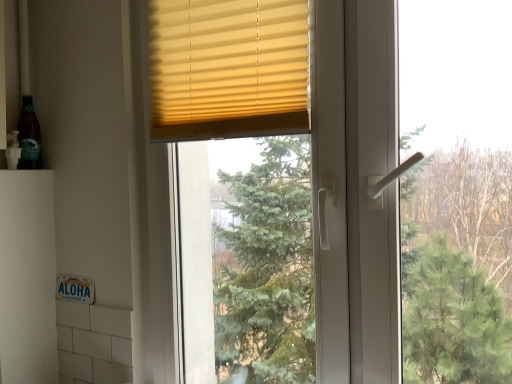
Identify the location of yellow matte blinds at upper center. This screenshot has width=512, height=384. (228, 68).

The width and height of the screenshot is (512, 384). What do you see at coordinates (228, 68) in the screenshot?
I see `yellow matte blinds at upper center` at bounding box center [228, 68].

At what (x,y) coordinates should I click in order to perform the action: click on translucent glass bottle at left. Please return your answer as a coordinate pair (x, y). The width and height of the screenshot is (512, 384). Looking at the image, I should click on (29, 136).

The image size is (512, 384). Describe the element at coordinates (29, 136) in the screenshot. I see `translucent glass bottle at left` at that location.

Locate an element on the screen. The height and width of the screenshot is (384, 512). yellow matte blinds at upper center is located at coordinates (228, 68).

Does translucent glass bottle at left appear on the right side of yellow matte blinds at upper center?

No, translucent glass bottle at left is not to the right of yellow matte blinds at upper center.

Is translucent glass bottle at left behind yellow matte blinds at upper center?

Yes, translucent glass bottle at left is further from the camera.

Is point (35, 141) positioned after point (183, 70)?

Yes, point (35, 141) is farther from viewer.

From the image's perspective, would you say translucent glass bottle at left is positioned over yellow matte blinds at upper center?

Incorrect, from the image's perspective, translucent glass bottle at left is lower than yellow matte blinds at upper center.

Consider the image. From a real-world perspective, which is physically above, translucent glass bottle at left or yellow matte blinds at upper center?

yellow matte blinds at upper center, from a real-world perspective.

Which object is wider, translucent glass bottle at left or yellow matte blinds at upper center?

translucent glass bottle at left.

Does translucent glass bottle at left have a greater height compared to yellow matte blinds at upper center?

No, translucent glass bottle at left is not taller than yellow matte blinds at upper center.

Considering the sizes of objects translucent glass bottle at left and yellow matte blinds at upper center in the image provided, who is bigger, translucent glass bottle at left or yellow matte blinds at upper center?

With larger size is yellow matte blinds at upper center.

Is translucent glass bottle at left not inside yellow matte blinds at upper center?

Yes, translucent glass bottle at left is outside of yellow matte blinds at upper center.

Are translucent glass bottle at left and yellow matte blinds at upper center far apart?

translucent glass bottle at left is actually quite close to yellow matte blinds at upper center.

Could you tell me if translucent glass bottle at left is facing yellow matte blinds at upper center?

Yes, translucent glass bottle at left is turned towards yellow matte blinds at upper center.

Looking at this image, how many degrees apart are the facing directions of translucent glass bottle at left and yellow matte blinds at upper center?

There is a 90-degree angle between the facing directions of translucent glass bottle at left and yellow matte blinds at upper center.

At what (x,y) coordinates should I click in order to perform the action: click on bottle that appears below the yellow matte blinds at upper center (from a real-world perspective). Please return your answer as a coordinate pair (x, y). The width and height of the screenshot is (512, 384). Looking at the image, I should click on (29, 136).

Is yellow matte blinds at upper center at the right side of translucent glass bottle at left?

Yes, yellow matte blinds at upper center is to the right of translucent glass bottle at left.

In the scene shown: Relative to translucent glass bottle at left, is yellow matte blinds at upper center in front or behind?

yellow matte blinds at upper center is in front of translucent glass bottle at left.

Does point (259, 48) lie behind point (29, 162)?

That is False.

From the image's perspective, is yellow matte blinds at upper center located beneath translucent glass bottle at left?

Incorrect, from the image's perspective, yellow matte blinds at upper center is higher than translucent glass bottle at left.

From a real-world perspective, is yellow matte blinds at upper center positioned above or below translucent glass bottle at left?

yellow matte blinds at upper center is situated higher than translucent glass bottle at left in the real world.

Looking at their sizes, would you say yellow matte blinds at upper center is wider or thinner than translucent glass bottle at left?

yellow matte blinds at upper center is thinner than translucent glass bottle at left.

Between yellow matte blinds at upper center and translucent glass bottle at left, which one has more height?

yellow matte blinds at upper center is taller.

Is yellow matte blinds at upper center smaller than translucent glass bottle at left?

No.

Would you say yellow matte blinds at upper center is outside translucent glass bottle at left?

yellow matte blinds at upper center is positioned outside translucent glass bottle at left.

Is yellow matte blinds at upper center far away from translucent glass bottle at left?

Actually, yellow matte blinds at upper center and translucent glass bottle at left are a little close together.

Could you tell me if yellow matte blinds at upper center is turned towards translucent glass bottle at left?

Result: No, yellow matte blinds at upper center is not facing towards translucent glass bottle at left.

Locate an element on the screen. The image size is (512, 384). bottle below the yellow matte blinds at upper center (from a real-world perspective) is located at coordinates 29,136.

The height and width of the screenshot is (384, 512). Find the location of `window blind above the translucent glass bottle at left (from a real-world perspective)`. window blind above the translucent glass bottle at left (from a real-world perspective) is located at coordinates (228, 68).

The image size is (512, 384). I want to click on window blind above the translucent glass bottle at left (from the image's perspective), so click(x=228, y=68).